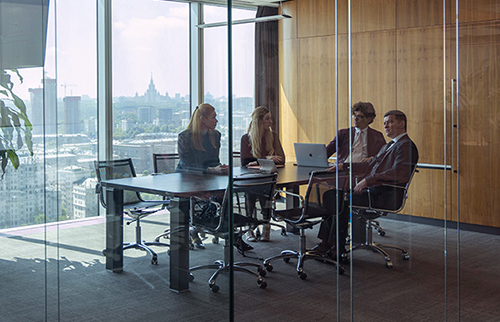
The width and height of the screenshot is (500, 322). Identify the location of window pane. [x=34, y=241], [x=134, y=274], [x=253, y=284], [x=494, y=233], [x=410, y=258], [x=214, y=68], [x=81, y=82], [x=153, y=83].